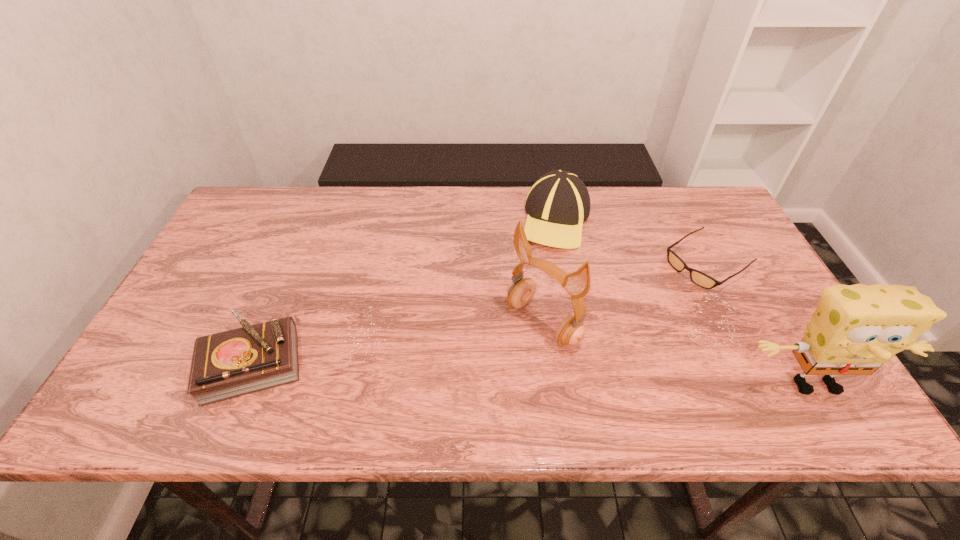
At what (x,y) coordinates should I click in order to perform the action: click on free space located 0.260m with the brim of the baseball cap facing forward. Please return your answer as a coordinate pair (x, y). The width and height of the screenshot is (960, 540). Looking at the image, I should click on (511, 314).

You are a GUI agent. You are given a task and a screenshot of the screen. Output one action in this format:
    pyautogui.click(x=<x>, y=<y>)
    Task: Click on the vacant space located 0.110m with the brim of the baseball cap facing forward
    The width and height of the screenshot is (960, 540).
    Given the screenshot: What is the action you would take?
    pyautogui.click(x=532, y=275)

What are the coordinates of `vacant space positioned with the brim of the baseball cap facing forward` in the screenshot? It's located at (536, 268).

Identify the location of free spot located on the front-facing side of the earphone. This screenshot has width=960, height=540. (484, 371).

Find the location of a particular element. Image resolution: width=960 pixels, height=540 pixels. object positioned at the far edge is located at coordinates (558, 203).

Locate an element on the screen. diary present at the near edge is located at coordinates (229, 364).

Find the location of `sponge that is at the near edge`. sponge that is at the near edge is located at coordinates tap(856, 329).

Find the location of a particular element. earphone that is at the near edge is located at coordinates (571, 331).

You are a GUI agent. You are given a task and a screenshot of the screen. Output one action in this format:
    pyautogui.click(x=<x>, y=<y>)
    Task: Click on the object present at the left edge
    Image resolution: width=960 pixels, height=540 pixels.
    Given the screenshot: What is the action you would take?
    (x=229, y=364)

Locate an element on the screen. sponge situated at the right edge is located at coordinates (856, 329).